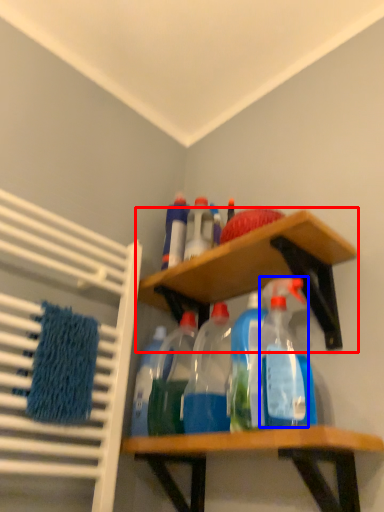
Question: Which of the following is the farthest to the observer, shelf (highlighted by a red box) or cleaning product (highlighted by a blue box)?

Choices:
 (A) shelf
 (B) cleaning product

Answer: (A)